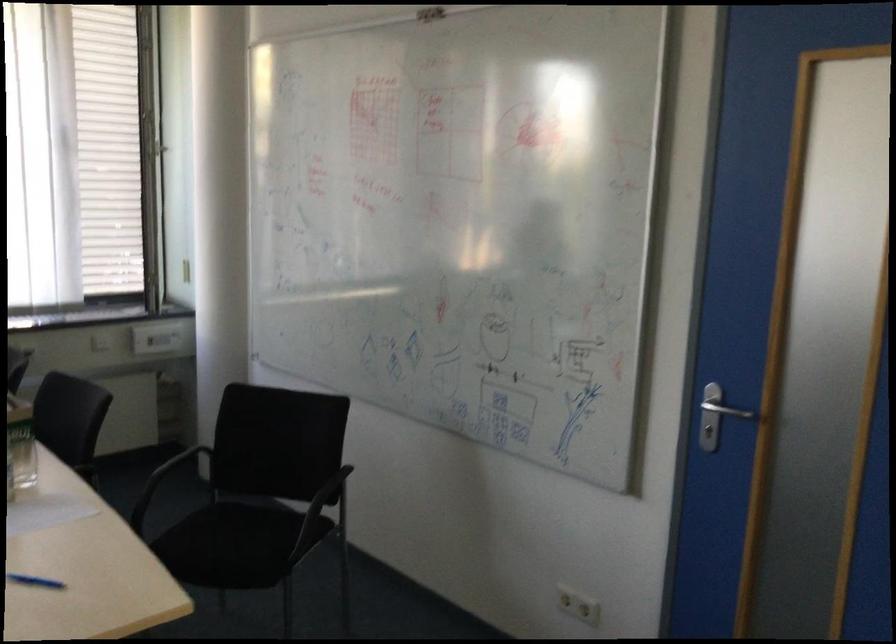
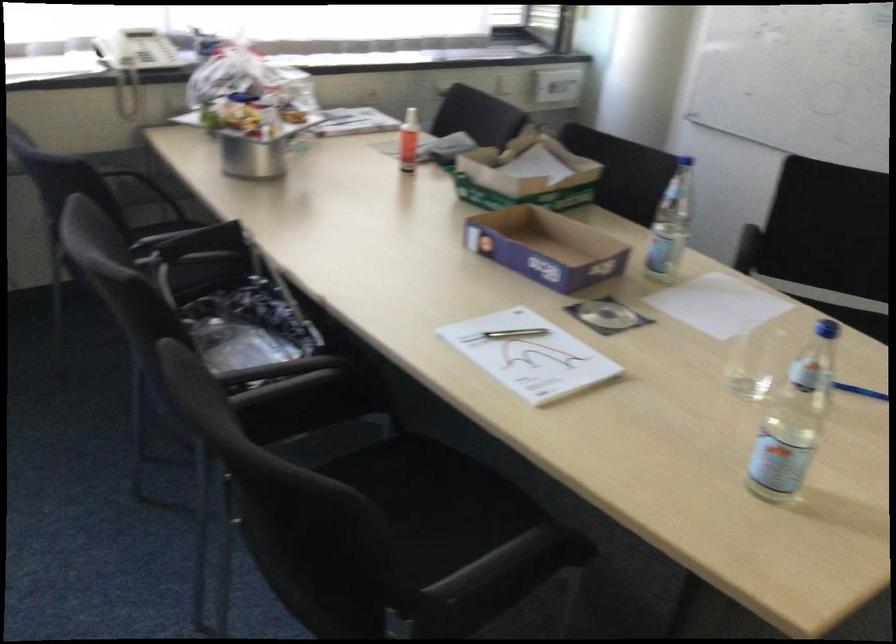
Question: What movement of the cameraman would produce the second image?

Choices:
 (A) Left
 (B) Right
 (C) Forward
 (D) Backward

Answer: (A)